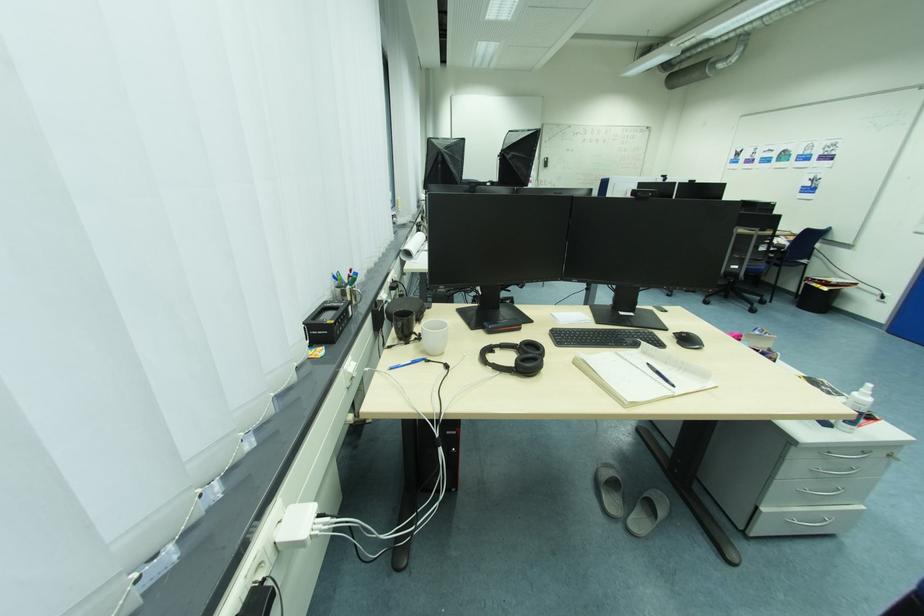
Image resolution: width=924 pixels, height=616 pixels. In order to click on open spiral notebook in this screenshot , I will do `click(642, 374)`.